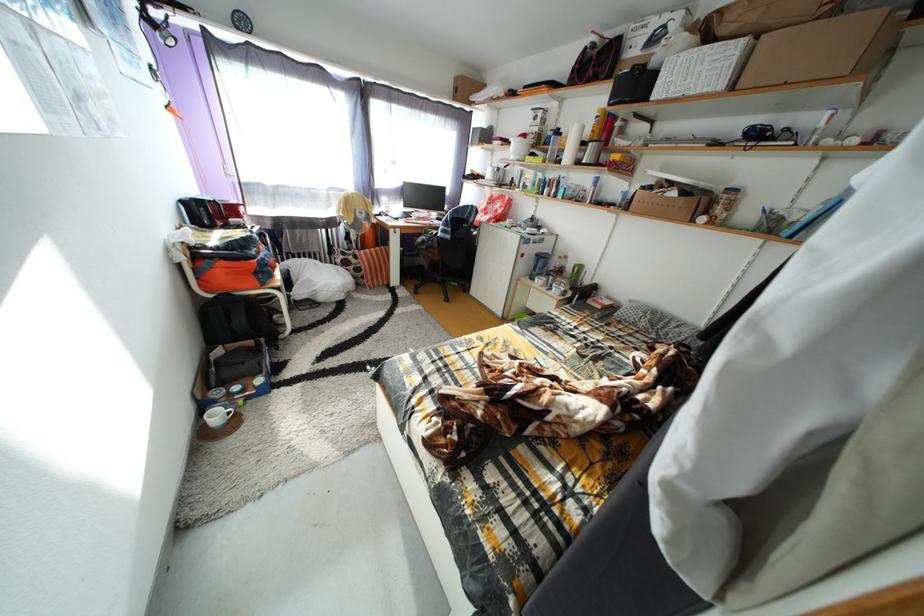
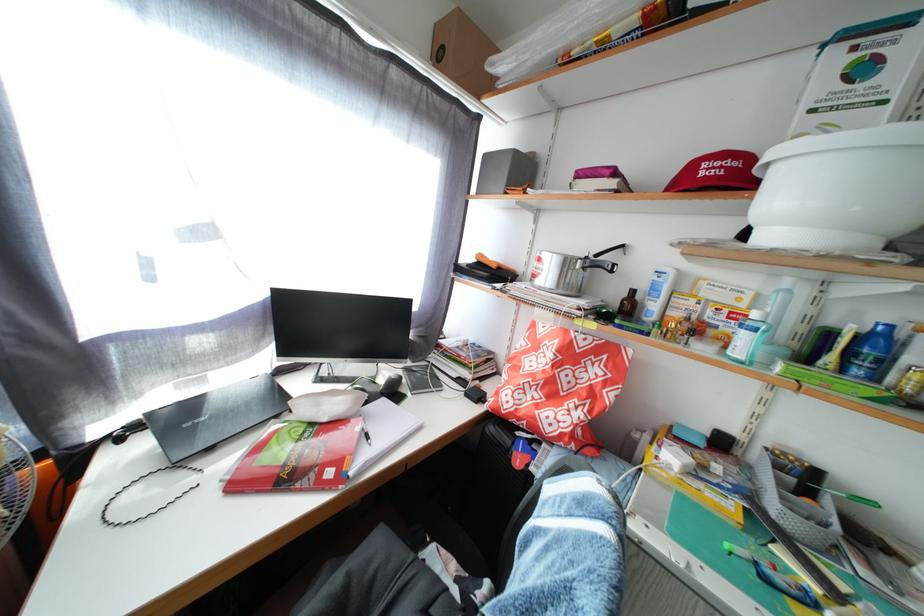
Question: In a continuous first-person perspective shot, in which direction is the camera moving?

Choices:
 (A) Left
 (B) Right
 (C) Forward
 (D) Backward

Answer: (C)